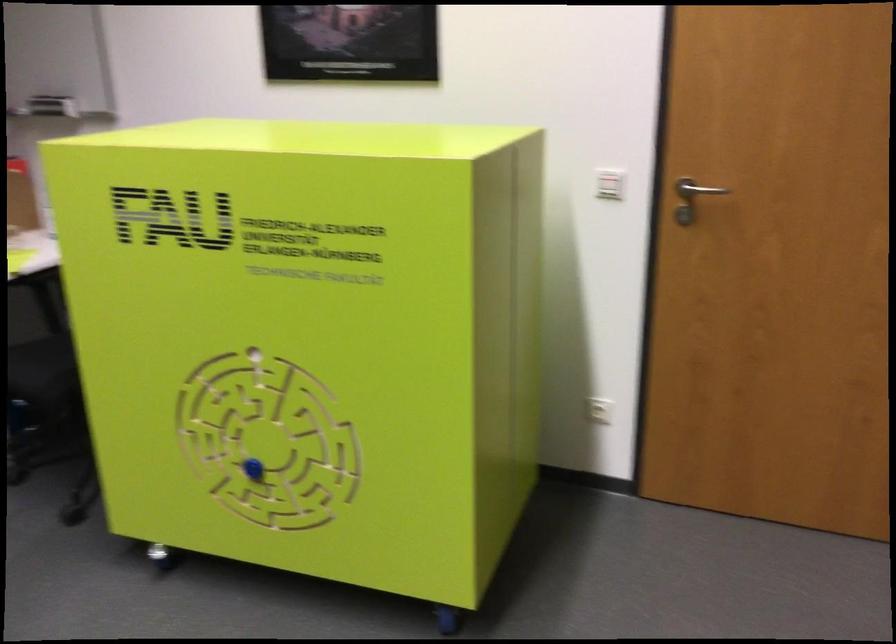
Identify the location of white light switch. The height and width of the screenshot is (644, 896). (609, 184).